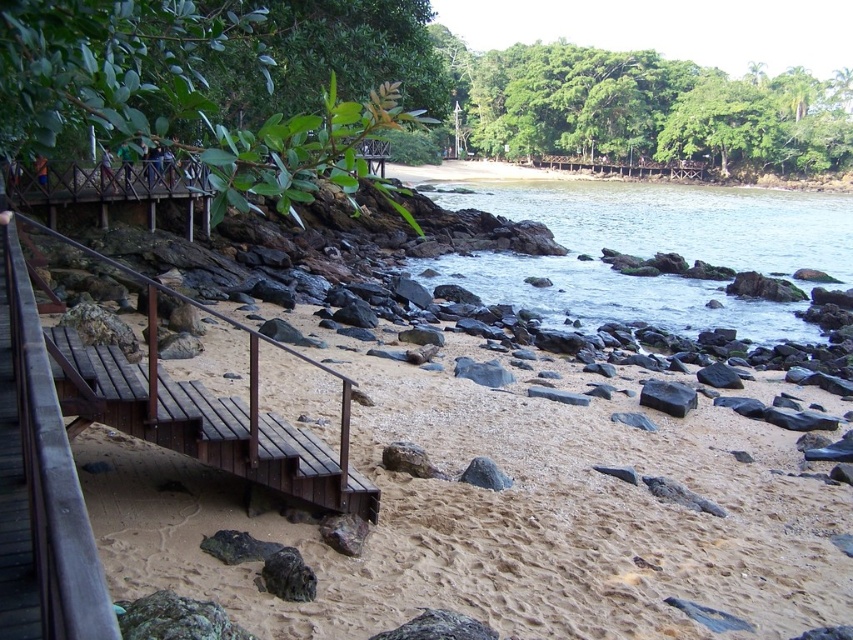
Question: Is sandy beach at lower left thinner than clear water at center?

Choices:
 (A) no
 (B) yes

Answer: (B)

Question: Estimate the real-world distances between objects in this image. Which object is farther from the sandy beach at lower left?

Choices:
 (A) clear water at center
 (B) brown wooden rail at left
 (C) black smooth rock at center
 (D) gray rock at center

Answer: (A)

Question: Based on their relative distances, which object is nearer to the sandy beach at lower left?

Choices:
 (A) clear water at center
 (B) gray rock at center
 (C) black smooth rock at center
 (D) brown wooden rail at left

Answer: (D)

Question: Does clear water at center have a smaller size compared to brown wooden rail at left?

Choices:
 (A) no
 (B) yes

Answer: (A)

Question: Can you confirm if sandy beach at lower left is positioned to the left of black smooth rock at center?

Choices:
 (A) no
 (B) yes

Answer: (B)

Question: Which object appears closest to the camera in this image?

Choices:
 (A) sandy beach at lower left
 (B) brown wooden rail at left
 (C) black smooth rock at center
 (D) gray rock at center

Answer: (A)